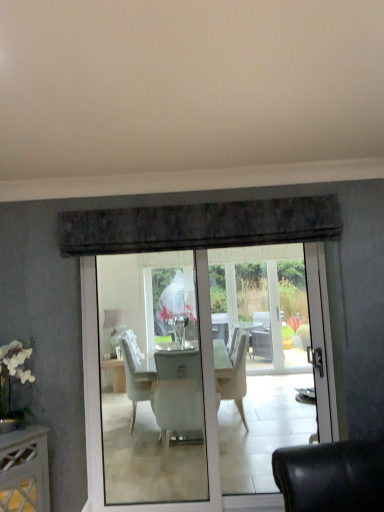
Question: Looking at the image, does matte white lampshade at center seem bigger or smaller compared to translucent glass vase at center?

Choices:
 (A) small
 (B) big

Answer: (A)

Question: Is matte white lampshade at center inside the boundaries of translucent glass vase at center, or outside?

Choices:
 (A) outside
 (B) inside

Answer: (A)

Question: Does point (114, 330) appear closer or farther from the camera than point (162, 309)?

Choices:
 (A) farther
 (B) closer

Answer: (A)

Question: Is translucent glass vase at center to the left or to the right of matte white lampshade at center in the image?

Choices:
 (A) left
 (B) right

Answer: (B)

Question: Do you think translucent glass vase at center is within matte white lampshade at center, or outside of it?

Choices:
 (A) outside
 (B) inside

Answer: (A)

Question: Relative to matte white lampshade at center, is translucent glass vase at center in front or behind?

Choices:
 (A) front
 (B) behind

Answer: (A)

Question: Considering the positions of translucent glass vase at center and matte white lampshade at center in the image, is translucent glass vase at center bigger or smaller than matte white lampshade at center?

Choices:
 (A) small
 (B) big

Answer: (B)